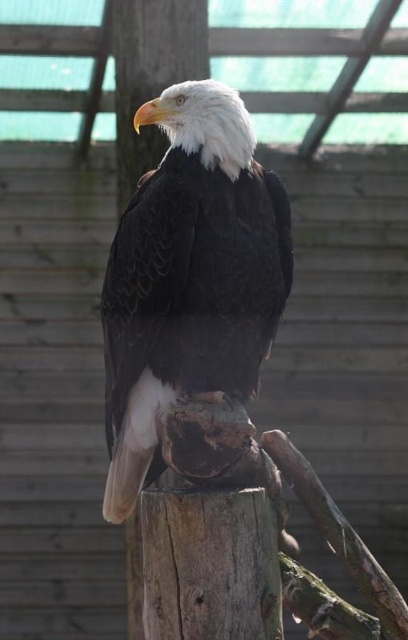
The image size is (408, 640). Describe the element at coordinates (190, 276) in the screenshot. I see `white-feathered eagle at center` at that location.

Can you confirm if white-feathered eagle at center is positioned to the left of brown rough wood at center?

No, white-feathered eagle at center is not to the left of brown rough wood at center.

Who is more distant from viewer, (115, 509) or (144, 81)?

Point (144, 81)

Locate an element on the screen. white-feathered eagle at center is located at coordinates (190, 276).